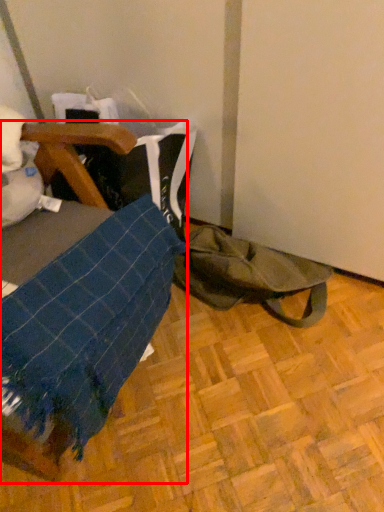
Question: From the image, what is the correct spatial relationship of furniture (annotated by the red box) in relation to tote bag?

Choices:
 (A) right
 (B) left

Answer: (B)